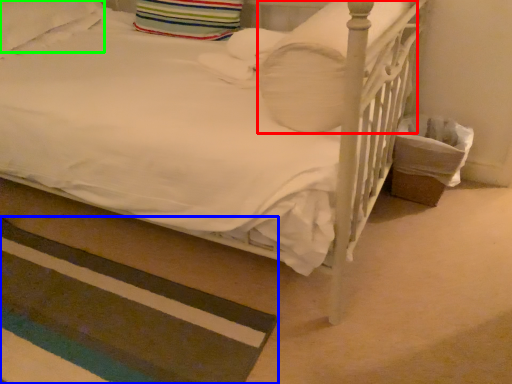
Question: Which is farther away from pillow (highlighted by a red box)? mat (highlighted by a blue box) or pillow (highlighted by a green box)?

Choices:
 (A) mat
 (B) pillow

Answer: (B)